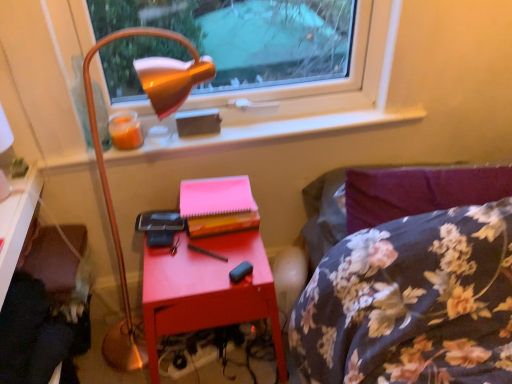
What are the coordinates of `free point above matte red nightstand at center (from a real-world perspective)` in the screenshot? It's located at (194, 246).